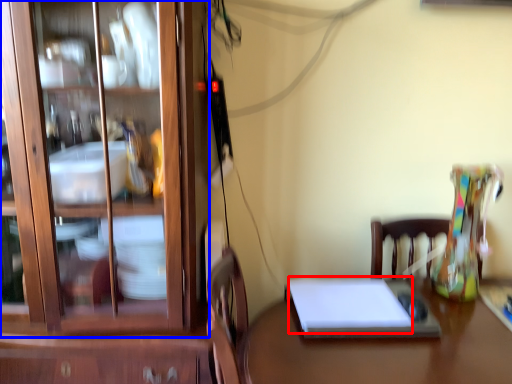
Question: Which object appears closest to the camera in this image, notebook (highlighted by a red box) or cabinetry (highlighted by a blue box)?

Choices:
 (A) notebook
 (B) cabinetry

Answer: (B)